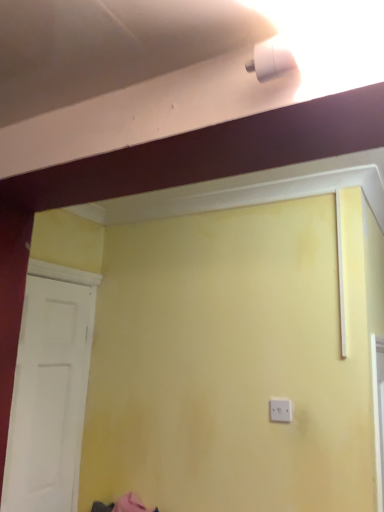
Measure the distance between point (285, 400) and camera.

The depth of point (285, 400) is 1.80 meters.

What do you see at coordinates (280, 410) in the screenshot? I see `white plastic electric outlet at center` at bounding box center [280, 410].

The image size is (384, 512). I want to click on white plastic electric outlet at center, so click(x=280, y=410).

Measure the distance between white plastic electric outlet at center and camera.

They are 5.82 feet apart.

What is the approximate width of white plastic electric outlet at center?

white plastic electric outlet at center is 0.78 inches in width.

Where is `white plastic electric outlet at center`? white plastic electric outlet at center is located at coordinates (280, 410).